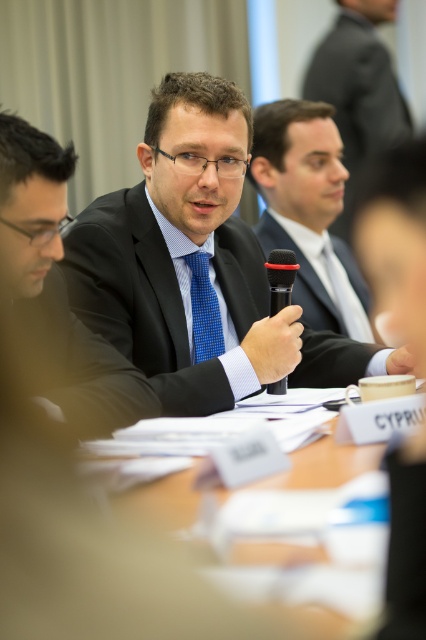
Question: Based on their relative distances, which object is farther from the dark gray suit at upper right?

Choices:
 (A) blue checkered tie at center
 (B) matte black microphone at center

Answer: (A)

Question: Considering the relative positions of wooden table at center and dark gray suit at upper right in the image provided, where is wooden table at center located with respect to dark gray suit at upper right?

Choices:
 (A) below
 (B) above

Answer: (A)

Question: Which object is farther from the camera taking this photo?

Choices:
 (A) black plastic microphone at center
 (B) matte black microphone at center
 (C) wooden table at center

Answer: (B)

Question: Does wooden table at center appear on the left side of dark gray suit at upper right?

Choices:
 (A) yes
 (B) no

Answer: (A)

Question: Which point is farther to the camera?

Choices:
 (A) (394, 125)
 (B) (198, 326)
 (C) (199, 438)

Answer: (A)

Question: Does matte black microphone at center come behind wooden table at center?

Choices:
 (A) yes
 (B) no

Answer: (A)